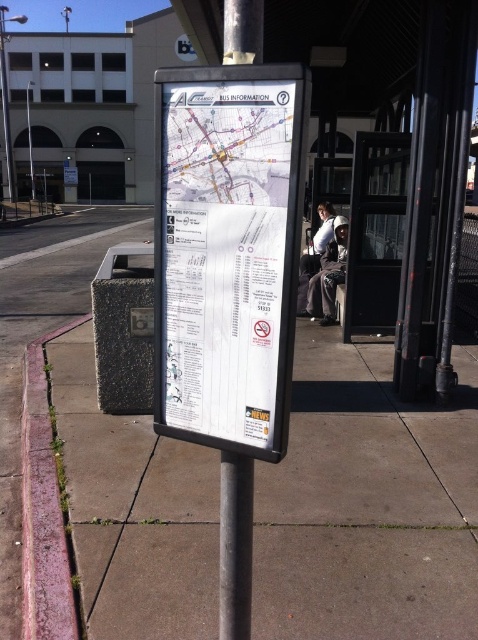
Image resolution: width=478 pixels, height=640 pixels. What do you see at coordinates (227, 253) in the screenshot? I see `white paper map at center` at bounding box center [227, 253].

Does white paper map at center appear over metallic gray pole at center?

Yes.

Is point (272, 214) closer to viewer compared to point (230, 452)?

Yes.

Where is `white paper map at center`? Image resolution: width=478 pixels, height=640 pixels. white paper map at center is located at coordinates (227, 253).

Does concrete sidewalk at center have a greater height compared to metallic gray pole at center?

No, concrete sidewalk at center is not taller than metallic gray pole at center.

Between point (303, 570) and point (250, 58), which one is positioned in front?

Point (250, 58)

In the scene shown: Who is more forward, (184,550) or (230,470)?

Point (230,470) is more forward.

In order to click on concrete sidewalk at center in this screenshot , I will do `click(368, 506)`.

Which is more to the right, white paper map at center or pink concrete curb at lower left?

From the viewer's perspective, white paper map at center appears more on the right side.

Is point (289, 211) positioned in front of point (25, 445)?

Yes, point (289, 211) is closer to viewer.

Measure the distance between point [159,102] and camera.

Point [159,102] is 4.61 feet away from camera.

Where is `white paper map at center`? The image size is (478, 640). white paper map at center is located at coordinates (227, 253).